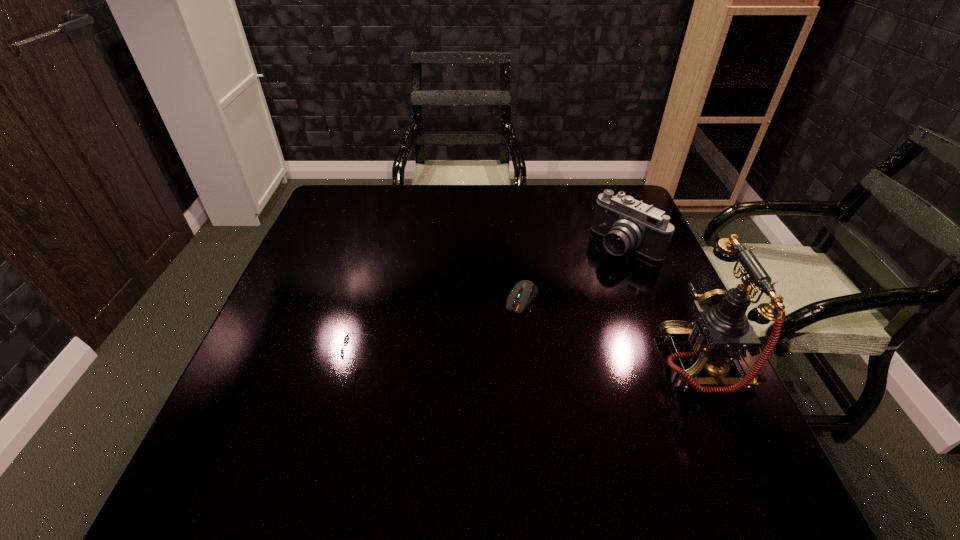
This screenshot has width=960, height=540. What are the coordinates of `vacant spot on the desktop that is between the third tallest object and the tallest object and is positioned on the front-facing side of the camera` in the screenshot? It's located at coord(490,363).

Identify the location of free spot on the desktop that is between the leftmost object and the tallest object and is positioned on the button of the computer equipment. (484, 363).